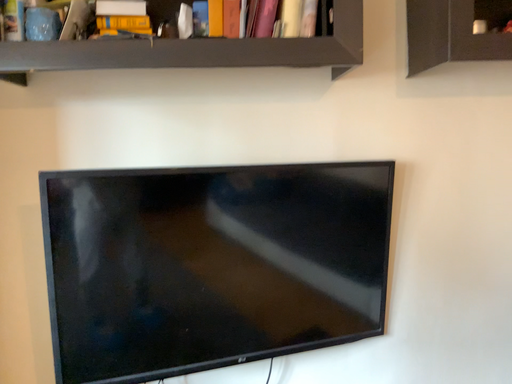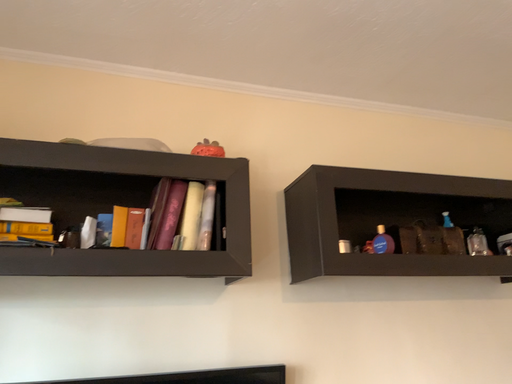
Question: How did the camera likely rotate when shooting the video?

Choices:
 (A) rotated right
 (B) rotated left

Answer: (A)